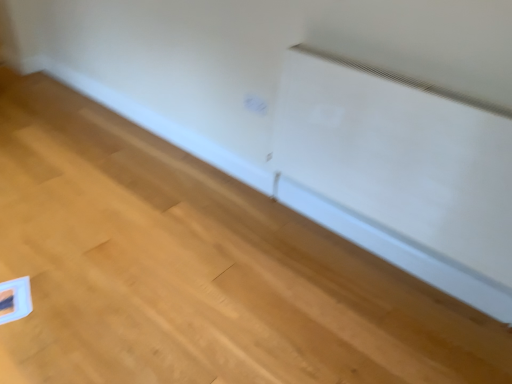
You are a GUI agent. You are given a task and a screenshot of the screen. Output one action in this format:
    pyautogui.click(x=<x>, y=<y>)
    Task: Click on the white matte air conditioning at upper center
    
    Given the screenshot: What is the action you would take?
    pyautogui.click(x=400, y=173)

The height and width of the screenshot is (384, 512). Describe the element at coordinates (400, 173) in the screenshot. I see `white matte air conditioning at upper center` at that location.

This screenshot has width=512, height=384. Find the location of `white matte air conditioning at upper center`. white matte air conditioning at upper center is located at coordinates (400, 173).